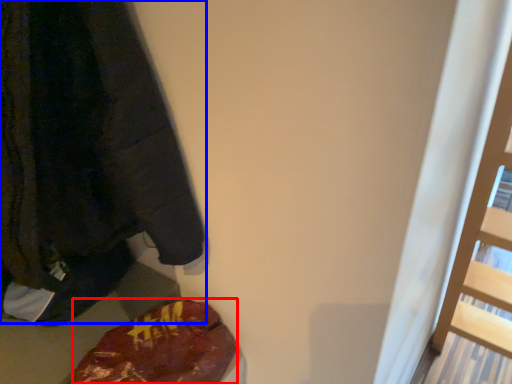
Question: Which object is closer to the camera taking this photo, food (highlighted by a red box) or sweatshirt (highlighted by a blue box)?

Choices:
 (A) food
 (B) sweatshirt

Answer: (B)